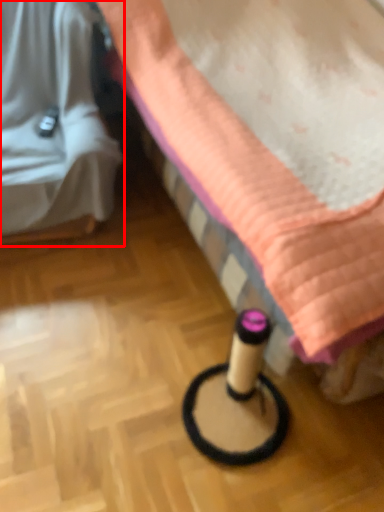
Question: In this image, where is furniture (annotated by the red box) located relative to furniture?

Choices:
 (A) right
 (B) left

Answer: (B)